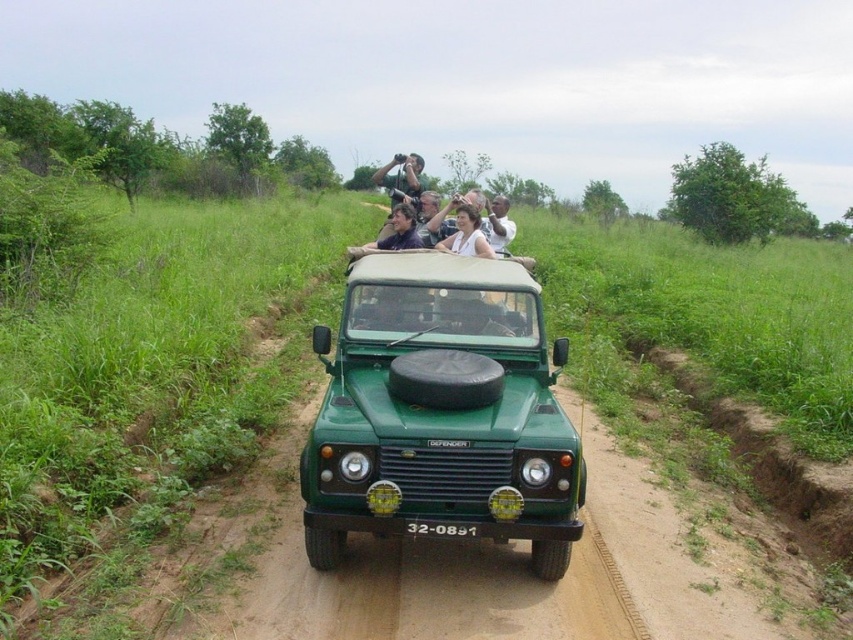
Which is in front, point (476, 218) or point (500, 250)?

Point (476, 218) is more forward.

Does point (453, 234) come behind point (509, 220)?

No, it is in front of (509, 220).

At what (x,y) coordinates should I click in order to perform the action: click on white fabric shirt at center. Please return your answer as a coordinate pair (x, y). The width and height of the screenshot is (853, 640). Looking at the image, I should click on (466, 234).

Is matte black camera at center to the left of light brown leather jacket at center from the viewer's perspective?

Yes, matte black camera at center is to the left of light brown leather jacket at center.

Is matte black camera at center wider than light brown leather jacket at center?

Indeed, matte black camera at center has a greater width compared to light brown leather jacket at center.

Does point (416, 154) come in front of point (488, 240)?

No, it is not.

The height and width of the screenshot is (640, 853). Identify the location of matte black camera at center. (402, 176).

Who is taller, light brown leather jacket at center or matte black shirt at center?

light brown leather jacket at center is taller.

Identify the location of light brown leather jacket at center. The height and width of the screenshot is (640, 853). (497, 224).

Locate an element on the screen. light brown leather jacket at center is located at coordinates (497, 224).